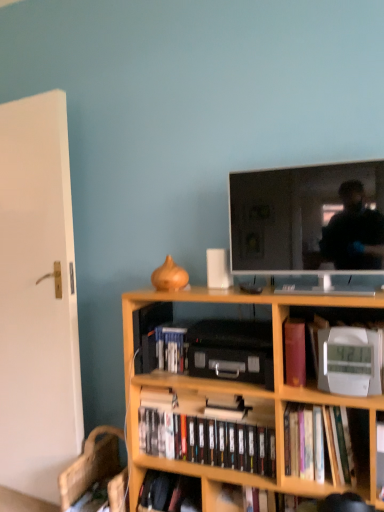
At what (x,y) coordinates should I click in order to perform the action: click on hardcover book at lower center, the 5th book from the top. Please return your answer as a coordinate pair (x, y). Image resolution: width=384 pixels, height=512 pixels. Looking at the image, I should click on (170, 492).

Measure the distance between hardcover book at lower center, the 5th book from the top, and camera.

The depth of hardcover book at lower center, the 5th book from the top, is 1.79 meters.

What do you see at coordinates (292, 215) in the screenshot?
I see `flat screen tv at upper center` at bounding box center [292, 215].

Describe the element at coordinates (233, 399) in the screenshot. I see `wooden bookcase at center` at that location.

Where is `white glossy book at center, arranged as the third book when ordered from the bottom`? This screenshot has height=512, width=384. white glossy book at center, arranged as the third book when ordered from the bottom is located at coordinates pos(170,348).

Locate an element on the screen. The height and width of the screenshot is (512, 384). purple matte bookshelf at center, positioned as the second book in top-to-bottom order is located at coordinates (294, 352).

Is black matte dvds at center, marked as the 2th book in a bottom-to-top arrangement, to the left of hardcover book at center from the viewer's perspective?

Yes, black matte dvds at center, marked as the 2th book in a bottom-to-top arrangement, is to the left of hardcover book at center.

From a real-world perspective, between black matte dvds at center, marked as the 2th book in a bottom-to-top arrangement, and hardcover book at center, who is vertically higher?

hardcover book at center, from a real-world perspective.

Considering the sizes of objects black matte dvds at center, the fourth book in the top-to-bottom sequence, and hardcover book at center in the image provided, who is taller, black matte dvds at center, the fourth book in the top-to-bottom sequence, or hardcover book at center?

hardcover book at center.

Is black matte dvds at center, the fourth book in the top-to-bottom sequence, positioned before hardcover book at center?

No.

Looking at their sizes, would you say white glossy book at center, arranged as the third book when ordered from the bottom, is wider or thinner than hardcover book at center?

Considering their sizes, white glossy book at center, arranged as the third book when ordered from the bottom, looks slimmer than hardcover book at center.

From the image's perspective, does white glossy book at center, arranged as the third book when ordered from the bottom, appear higher than hardcover book at center?

Correct, white glossy book at center, arranged as the third book when ordered from the bottom, appears higher than hardcover book at center in the image.

In terms of size, does white glossy book at center, the 3th book from the top, appear bigger or smaller than hardcover book at center?

white glossy book at center, the 3th book from the top, is smaller than hardcover book at center.

Can you confirm if white glossy book at center, arranged as the third book when ordered from the bottom, is positioned to the right of hardcover book at center?

Incorrect, white glossy book at center, arranged as the third book when ordered from the bottom, is not on the right side of hardcover book at center.

Considering the sizes of white plastic clock at lower right, arranged as the 1th book when viewed from the top, and purple matte bookshelf at center, the fourth book positioned from the bottom, in the image, is white plastic clock at lower right, arranged as the 1th book when viewed from the top, wider or thinner than purple matte bookshelf at center, the fourth book positioned from the bottom,?

In the image, white plastic clock at lower right, arranged as the 1th book when viewed from the top, appears to be more narrow than purple matte bookshelf at center, the fourth book positioned from the bottom.

Is white plastic clock at lower right, the fifth book when ordered from bottom to top, oriented towards purple matte bookshelf at center, the fourth book positioned from the bottom?

No, white plastic clock at lower right, the fifth book when ordered from bottom to top, is not facing towards purple matte bookshelf at center, the fourth book positioned from the bottom.

Considering the positions of objects white plastic clock at lower right, arranged as the 1th book when viewed from the top, and purple matte bookshelf at center, positioned as the second book in top-to-bottom order, in the image provided, who is more to the left, white plastic clock at lower right, arranged as the 1th book when viewed from the top, or purple matte bookshelf at center, positioned as the second book in top-to-bottom order,?

purple matte bookshelf at center, positioned as the second book in top-to-bottom order.

Is white plastic clock at lower right, the fifth book when ordered from bottom to top, inside or outside of wooden computer chair at lower left?

white plastic clock at lower right, the fifth book when ordered from bottom to top, is located beyond the bounds of wooden computer chair at lower left.

Can you see white plastic clock at lower right, arranged as the 1th book when viewed from the top, touching wooden computer chair at lower left?

There is a gap between white plastic clock at lower right, arranged as the 1th book when viewed from the top, and wooden computer chair at lower left.

How much distance is there between white plastic clock at lower right, arranged as the 1th book when viewed from the top, and wooden computer chair at lower left?

white plastic clock at lower right, arranged as the 1th book when viewed from the top, is 3.69 feet away from wooden computer chair at lower left.

Is white plastic clock at lower right, the fifth book when ordered from bottom to top, to the left of wooden computer chair at lower left from the viewer's perspective?

No.

Is white plastic clock at lower right, arranged as the 1th book when viewed from the top, looking in the opposite direction of black matte dvds at center, the fourth book in the top-to-bottom sequence?

No, white plastic clock at lower right, arranged as the 1th book when viewed from the top, is not facing the opposite direction of black matte dvds at center, the fourth book in the top-to-bottom sequence.

Is there a large distance between white plastic clock at lower right, the fifth book when ordered from bottom to top, and black matte dvds at center, marked as the 2th book in a bottom-to-top arrangement?

They are positioned close to each other.

From their relative heights in the image, would you say white plastic clock at lower right, the fifth book when ordered from bottom to top, is taller or shorter than black matte dvds at center, marked as the 2th book in a bottom-to-top arrangement?

Clearly, white plastic clock at lower right, the fifth book when ordered from bottom to top, is taller compared to black matte dvds at center, marked as the 2th book in a bottom-to-top arrangement.

From a real-world perspective, which is physically above, white plastic clock at lower right, the fifth book when ordered from bottom to top, or black matte dvds at center, the fourth book in the top-to-bottom sequence?

In real-world perspective, white plastic clock at lower right, the fifth book when ordered from bottom to top, is above.

Is point (326, 226) closer to camera compared to point (168, 334)?

Yes, it is in front of point (168, 334).

Does flat screen tv at upper center have a larger size compared to white glossy book at center, the 3th book from the top?

Yes.

Does flat screen tv at upper center turn towards white glossy book at center, the 3th book from the top?

No, flat screen tv at upper center is not aimed at white glossy book at center, the 3th book from the top.

Is flat screen tv at upper center located outside white glossy book at center, the 3th book from the top?

That's correct, flat screen tv at upper center is outside of white glossy book at center, the 3th book from the top.

Is flat screen tv at upper center facing towards black matte dvds at center, marked as the 2th book in a bottom-to-top arrangement?

No, flat screen tv at upper center is not turned towards black matte dvds at center, marked as the 2th book in a bottom-to-top arrangement.

Would you say flat screen tv at upper center is inside or outside black matte dvds at center, marked as the 2th book in a bottom-to-top arrangement?

flat screen tv at upper center lies outside black matte dvds at center, marked as the 2th book in a bottom-to-top arrangement.

In the image, is flat screen tv at upper center positioned in front of or behind black matte dvds at center, marked as the 2th book in a bottom-to-top arrangement?

Visually, flat screen tv at upper center is located in front of black matte dvds at center, marked as the 2th book in a bottom-to-top arrangement.

Is point (232, 258) positioned before point (270, 438)?

No, it is behind (270, 438).

Image resolution: width=384 pixels, height=512 pixels. Find the location of `book that is the 1st object located below the hardcover book at center (from the image's perspective)`. book that is the 1st object located below the hardcover book at center (from the image's perspective) is located at coordinates (205, 435).

At what (x,y) coordinates should I click in order to perform the action: click on paperback book lying in front of the white glossy book at center, arranged as the third book when ordered from the bottom. Please return your answer as a coordinate pair (x, y). Looking at the image, I should click on (339, 446).

Looking at the image, which one is located closer to wooden computer chair at lower left, white glossy book at center, arranged as the third book when ordered from the bottom, or black matte dvds at center, marked as the 2th book in a bottom-to-top arrangement?

Among the two, black matte dvds at center, marked as the 2th book in a bottom-to-top arrangement, is located nearer to wooden computer chair at lower left.

Estimate the real-world distances between objects in this image. Which object is further from black matte dvds at center, marked as the 2th book in a bottom-to-top arrangement, white plastic clock at lower right, arranged as the 1th book when viewed from the top, or hardcover book at center?

Among the two, white plastic clock at lower right, arranged as the 1th book when viewed from the top, is located further to black matte dvds at center, marked as the 2th book in a bottom-to-top arrangement.

When comparing their distances from wooden bookcase at center, does hardcover book at lower center, arranged as the first book when ordered from the bottom, or white glossy book at center, arranged as the third book when ordered from the bottom, seem closer?

white glossy book at center, arranged as the third book when ordered from the bottom.

When comparing their distances from flat screen tv at upper center, does hardcover book at center or white plastic clock at lower right, the fifth book when ordered from bottom to top, seem further?

hardcover book at center is further to flat screen tv at upper center.

Based on their spatial positions, is hardcover book at center or purple matte bookshelf at center, the fourth book positioned from the bottom, closer to black matte dvds at center, marked as the 2th book in a bottom-to-top arrangement?

purple matte bookshelf at center, the fourth book positioned from the bottom, lies closer to black matte dvds at center, marked as the 2th book in a bottom-to-top arrangement, than the other object.

Estimate the real-world distances between objects in this image. Which object is further from purple matte bookshelf at center, the fourth book positioned from the bottom, white plastic clock at lower right, arranged as the 1th book when viewed from the top, or flat screen tv at upper center?

flat screen tv at upper center is further to purple matte bookshelf at center, the fourth book positioned from the bottom.

Which object lies nearer to the anchor point wooden bookcase at center, hardcover book at center or white glossy book at center, arranged as the third book when ordered from the bottom?

Based on the image, white glossy book at center, arranged as the third book when ordered from the bottom, appears to be nearer to wooden bookcase at center.

Consider the image. Looking at the image, which one is located further to wooden computer chair at lower left, white glossy book at center, arranged as the third book when ordered from the bottom, or wooden bookcase at center?

white glossy book at center, arranged as the third book when ordered from the bottom, is further to wooden computer chair at lower left.

Locate an element on the screen. Image resolution: width=384 pixels, height=512 pixels. paperback book between white glossy book at center, arranged as the third book when ordered from the bottom, and white plastic clock at lower right, the fifth book when ordered from bottom to top, from left to right is located at coordinates (339, 446).

Identify the location of bookcase that lies between flat screen tv at upper center and wooden computer chair at lower left from top to bottom. (233, 399).

The image size is (384, 512). In order to click on bookcase between white glossy book at center, the 3th book from the top, and wooden computer chair at lower left, in the vertical direction in this screenshot , I will do `click(233, 399)`.

Where is `bookcase between hardcover book at lower center, arranged as the first book when ordered from the bottom, and hardcover book at center`? bookcase between hardcover book at lower center, arranged as the first book when ordered from the bottom, and hardcover book at center is located at coordinates (233, 399).